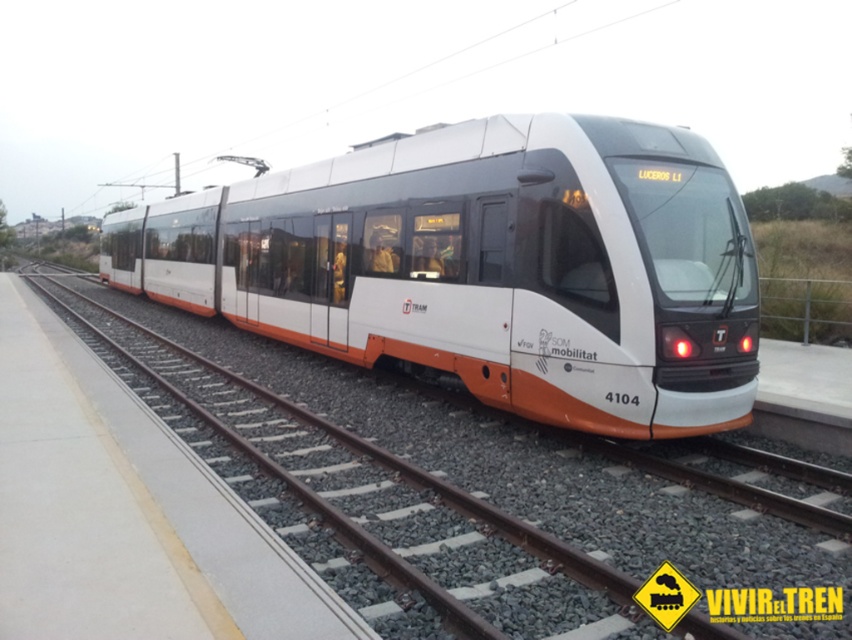
Question: Among these objects, which one is farthest from the camera?

Choices:
 (A) white metal track at center
 (B) white matte train at center

Answer: (B)

Question: Does white matte train at center have a larger size compared to white metal track at center?

Choices:
 (A) yes
 (B) no

Answer: (A)

Question: Is white matte train at center closer to camera compared to white metal track at center?

Choices:
 (A) no
 (B) yes

Answer: (A)

Question: Is white matte train at center further to camera compared to white metal track at center?

Choices:
 (A) no
 (B) yes

Answer: (B)

Question: Which object is closer to the camera taking this photo?

Choices:
 (A) white matte train at center
 (B) white metal track at center

Answer: (B)